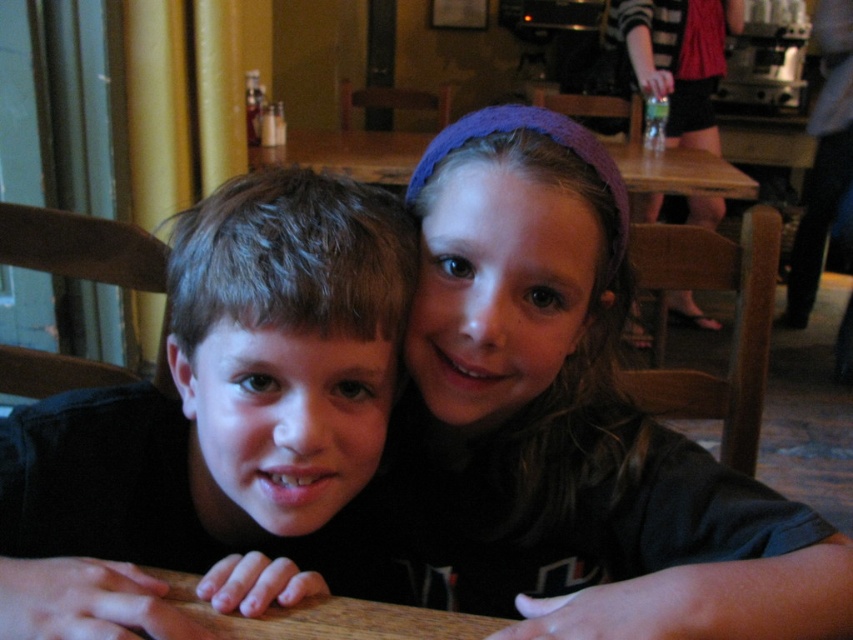
You are a photographer trying to capture the girl with the purple headband in the image. The camera focuses on the point at coordinates (572,420). Is the purple knitted headband at upper center in focus?

The purple knitted headband at upper center is located at point (572,420), so yes, the purple knitted headband at upper center is in focus since the camera focuses on that point.

Based on the photo, you are a photographer taking a picture of the matte black shirt at center and the green plastic bottle at upper right. Which object will appear larger in the photo?

The matte black shirt at center will appear larger in the photo because it is closer to the viewer than the green plastic bottle at upper right.

Based on the photo, you are a photographer trying to capture a closeup of the purple knitted headband at upper center. Based on its coordinates, which direction should you move your camera to get closer to it?

The purple knitted headband at upper center is located at point [572,420]. To get closer to it, move the camera to the right and slightly upward since the coordinates indicate it is positioned towards the right and upper part of the image.